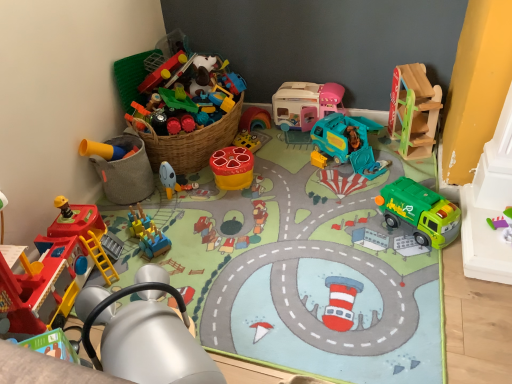
Locate an element on the screen. The image size is (512, 384). free location to the right of yellow matte bucket at lower left, the first toy in the left-to-right sequence is located at coordinates (184, 190).